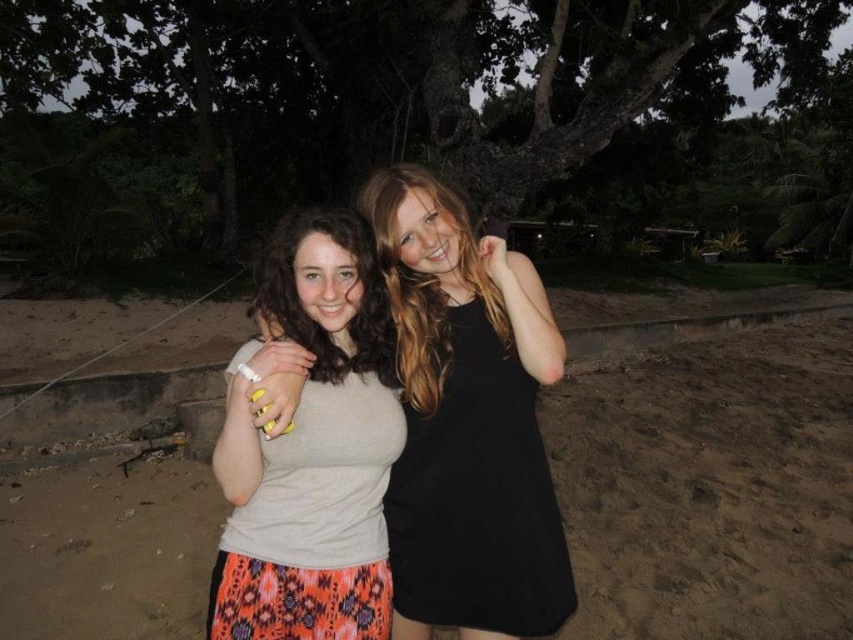
Question: Which point is closer to the camera?

Choices:
 (A) (309, 332)
 (B) (271, 243)
 (C) (630, 426)
 (D) (466, 307)

Answer: (A)

Question: Is sandy beach at center below matte gray tank top at center?

Choices:
 (A) no
 (B) yes

Answer: (B)

Question: Where is sandy beach at center located in relation to matte beige shirt at center in the image?

Choices:
 (A) below
 (B) above

Answer: (A)

Question: Does sandy beach at center have a smaller size compared to matte beige shirt at center?

Choices:
 (A) no
 (B) yes

Answer: (A)

Question: Which object is the farthest from the matte gray tank top at center?

Choices:
 (A) matte beige shirt at center
 (B) sandy beach at center
 (C) matte beige tank top at center

Answer: (B)

Question: Which object appears farthest from the camera in this image?

Choices:
 (A) matte gray tank top at center
 (B) matte beige tank top at center

Answer: (A)